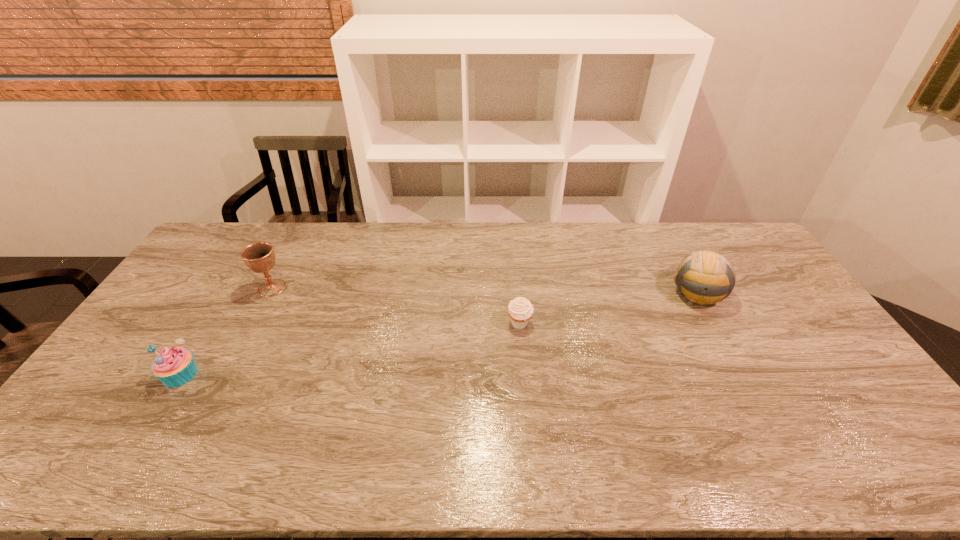
Identify the location of free spot that satisfies the following two spatial constraints: 1. on the back side of the chalice; 2. on the right side of the leftmost object. This screenshot has width=960, height=540. (234, 288).

Find the location of a particular element. The width and height of the screenshot is (960, 540). vacant region that satisfies the following two spatial constraints: 1. on the front side of the right muffin; 2. on the right side of the second object from left to right is located at coordinates (253, 323).

You are a GUI agent. You are given a task and a screenshot of the screen. Output one action in this format:
    pyautogui.click(x=<x>, y=<y>)
    Task: Click on the vacant area that satisfies the following two spatial constraints: 1. on the back side of the volleyball; 2. on the right side of the farther muffin
    Image resolution: width=960 pixels, height=540 pixels.
    Given the screenshot: What is the action you would take?
    pyautogui.click(x=517, y=294)